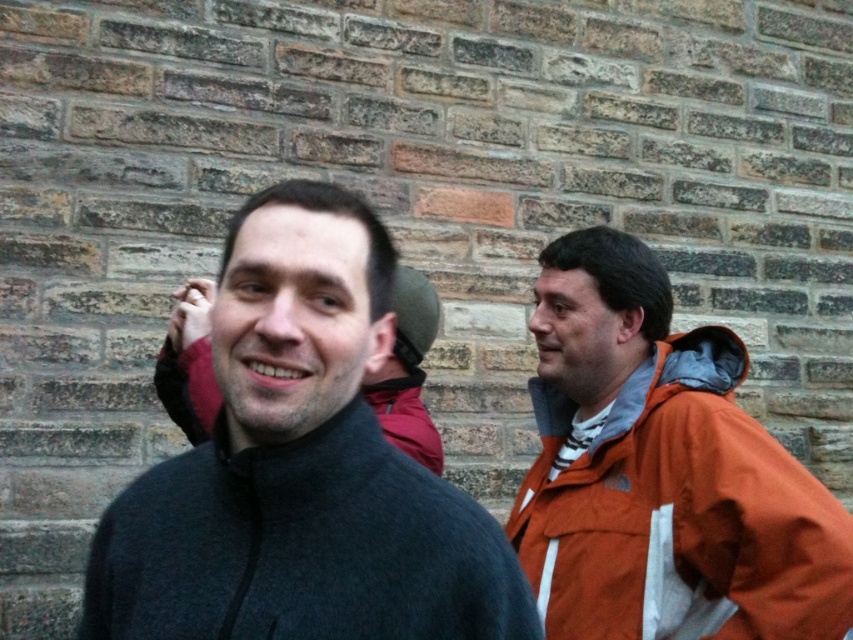
Question: Which point is farther to the camera?

Choices:
 (A) dark gray fleece jacket at center
 (B) orange fabric jacket at right

Answer: (B)

Question: Is dark gray fleece jacket at center bigger than orange fabric jacket at right?

Choices:
 (A) yes
 (B) no

Answer: (B)

Question: In this image, where is dark gray fleece jacket at center located relative to orange fabric jacket at right?

Choices:
 (A) right
 (B) left

Answer: (B)

Question: Is dark gray fleece jacket at center thinner than orange fabric jacket at right?

Choices:
 (A) yes
 (B) no

Answer: (B)